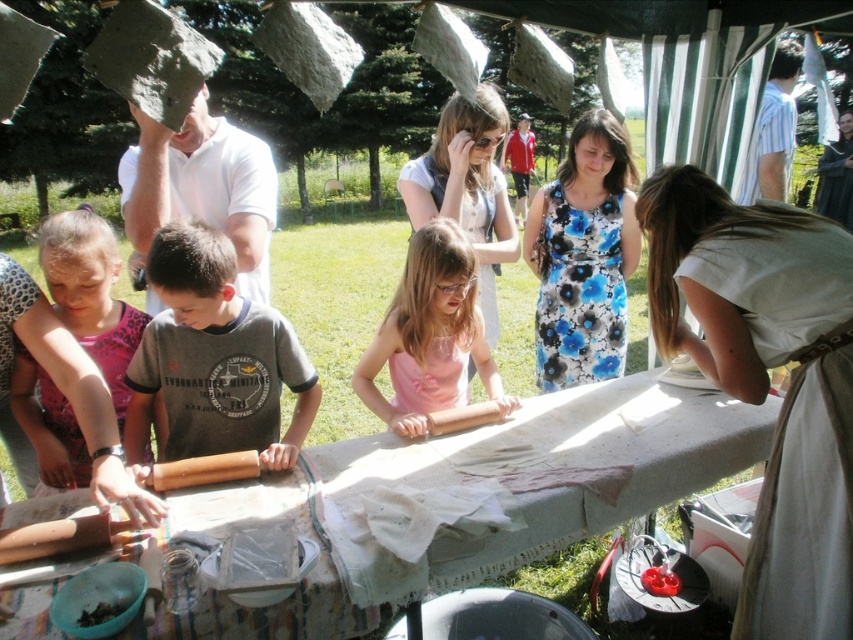
Question: Estimate the real-world distances between objects in this image. Which object is closer to the brown wooden rolling pin at center?

Choices:
 (A) pink fabric at center
 (B) pink floral dress at lower left
 (C) white cloth-covered table at center

Answer: (B)

Question: Can you confirm if brown wooden rolling pin at center is positioned to the left of pink fabric at center?

Choices:
 (A) yes
 (B) no

Answer: (A)

Question: Which point is closer to the camera taking this photo?

Choices:
 (A) (x=77, y=625)
 (B) (x=503, y=563)

Answer: (A)

Question: Does pink floral dress at lower left appear on the right side of pink fabric at center?

Choices:
 (A) no
 (B) yes

Answer: (A)

Question: Can you confirm if white cloth-covered table at center is positioned above pink fabric at center?

Choices:
 (A) yes
 (B) no

Answer: (B)

Question: Among these points, which one is farthest from the camera?

Choices:
 (A) (184, 275)
 (B) (445, 369)
 (C) (85, 624)
 (D) (62, 234)

Answer: (B)